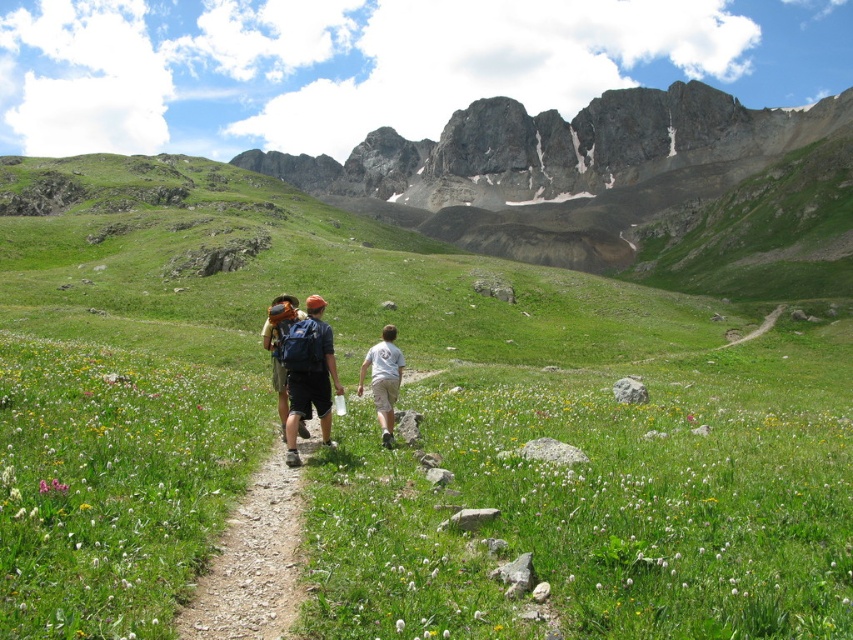
You are standing at the point with coordinates point (281, 365) and want to move towards the point with coordinates point (316, 376). Which direction should you move in to get closer to that point?

You should move forward because point (316, 376) is closer to the viewer than point (281, 365), so moving forward towards it would bring you closer.